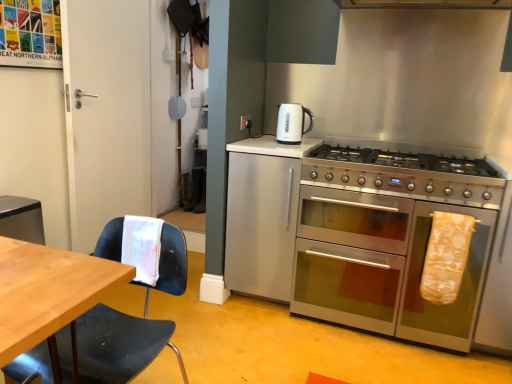
Question: Is yellow fabric oven mitt at right, the first material viewed from the right, at the right side of white matte door at left?

Choices:
 (A) no
 (B) yes

Answer: (B)

Question: Can you confirm if yellow fabric oven mitt at right, which is the 1th material from back to front, is taller than white matte door at left?

Choices:
 (A) no
 (B) yes

Answer: (A)

Question: From the image's perspective, is yellow fabric oven mitt at right, which is the second material from left to right, over white matte door at left?

Choices:
 (A) yes
 (B) no

Answer: (B)

Question: From a real-world perspective, is yellow fabric oven mitt at right, the first material viewed from the right, under white matte door at left?

Choices:
 (A) no
 (B) yes

Answer: (B)

Question: From a real-world perspective, is yellow fabric oven mitt at right, the first material viewed from the right, on top of white matte door at left?

Choices:
 (A) no
 (B) yes

Answer: (A)

Question: In the image, is white paper towel at left, the 1th material viewed from the front, positioned in front of or behind stainless steel gas stove at right?

Choices:
 (A) behind
 (B) front

Answer: (B)

Question: Is point (156, 269) closer or farther from the camera than point (435, 188)?

Choices:
 (A) closer
 (B) farther

Answer: (A)

Question: Is white paper towel at left, the 1th material viewed from the front, wider or thinner than stainless steel gas stove at right?

Choices:
 (A) thin
 (B) wide

Answer: (A)

Question: Is white paper towel at left, the second material when ordered from back to front, situated inside stainless steel gas stove at right or outside?

Choices:
 (A) inside
 (B) outside

Answer: (B)

Question: Considering the positions of point (158, 258) and point (111, 235), is point (158, 258) closer or farther from the camera than point (111, 235)?

Choices:
 (A) closer
 (B) farther

Answer: (B)

Question: Is white paper towel at left, the second material when ordered from back to front, situated inside black plastic chair at left or outside?

Choices:
 (A) outside
 (B) inside

Answer: (B)

Question: From the image's perspective, is white paper towel at left, the second material when ordered from back to front, above or below black plastic chair at left?

Choices:
 (A) below
 (B) above

Answer: (B)

Question: In the image, is white paper towel at left, the 1th material viewed from the front, positioned in front of or behind black plastic chair at left?

Choices:
 (A) front
 (B) behind

Answer: (B)

Question: From the image's perspective, is white glossy electric kettle at upper center positioned above or below stainless steel gas stove at right?

Choices:
 (A) above
 (B) below

Answer: (A)

Question: In terms of height, does white glossy electric kettle at upper center look taller or shorter compared to stainless steel gas stove at right?

Choices:
 (A) short
 (B) tall

Answer: (B)